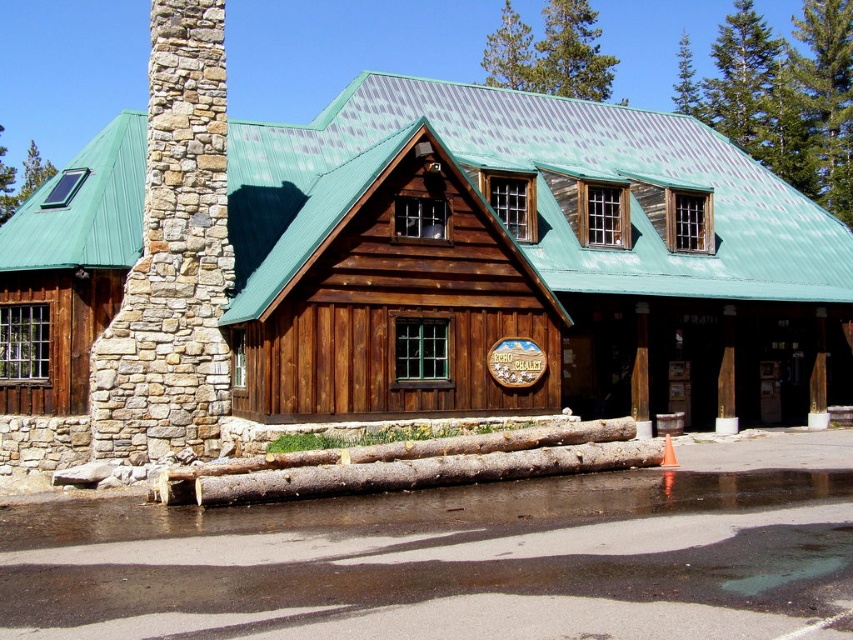
Does wooden cabin at center appear on the left side of natural stone chimney at left?

No, wooden cabin at center is not to the left of natural stone chimney at left.

Does wooden cabin at center appear under natural stone chimney at left?

No, wooden cabin at center is not below natural stone chimney at left.

At what (x,y) coordinates should I click in order to perform the action: click on wooden cabin at center. Please return your answer as a coordinate pair (x, y). The width and height of the screenshot is (853, 640). Looking at the image, I should click on (531, 259).

At what (x,y) coordinates should I click in order to perform the action: click on wooden cabin at center. Please return your answer as a coordinate pair (x, y). Looking at the image, I should click on (531, 259).

Who is taller, natural stone chimney at left or smooth gray wood logs at center?

natural stone chimney at left

Does point (99, 369) lie in front of point (196, 483)?

No.

Does point (213, 211) come behind point (607, 420)?

That is True.

Where is `natural stone chimney at left`? natural stone chimney at left is located at coordinates (173, 257).

The image size is (853, 640). Describe the element at coordinates (531, 259) in the screenshot. I see `wooden cabin at center` at that location.

Measure the distance from wooden cabin at center to smooth gray wood logs at center.

wooden cabin at center and smooth gray wood logs at center are 9.97 meters apart from each other.

Who is more distant from viewer, (61, 307) or (157, 500)?

Positioned behind is point (61, 307).

Locate an element on the screen. wooden cabin at center is located at coordinates (531, 259).